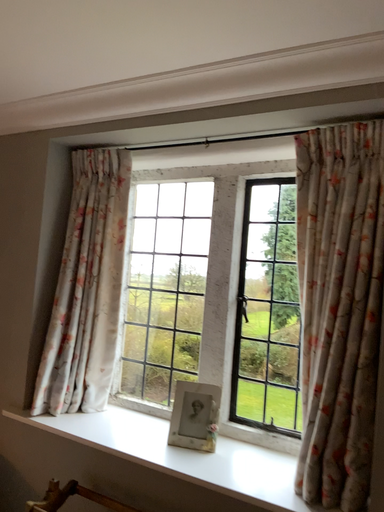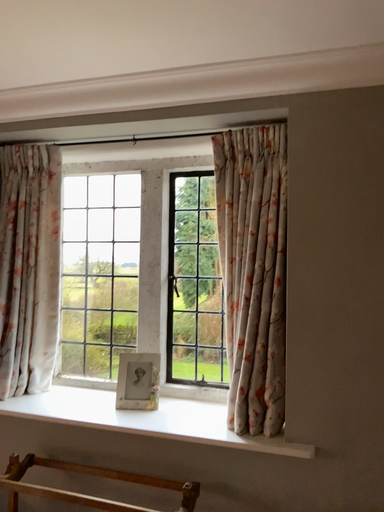
Question: How did the camera likely rotate when shooting the video?

Choices:
 (A) rotated left
 (B) rotated right

Answer: (B)